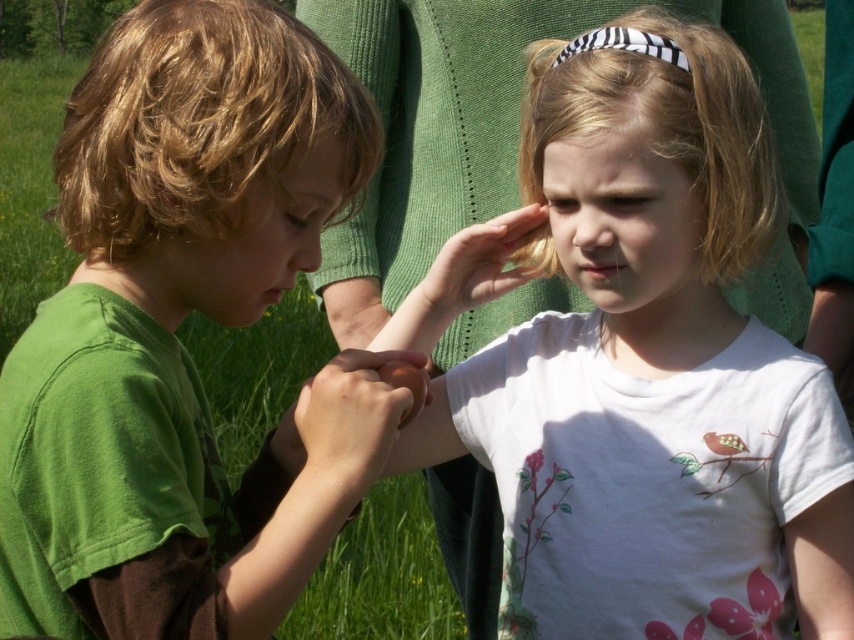
You are a photographer trying to capture a closeup of the white matte shirt at center and the blonde hair at upper right. Based on their positions, which one should you focus on first to ensure both are in the frame?

The white matte shirt at center is below the blonde hair at upper right, so you should focus on the blonde hair at upper right first to ensure both are in the frame.

You are a photographer trying to capture the perfect shot of the two children. You notice the white matte shirt at center and the blonde hair at upper right. Which object should you focus on to ensure it appears more prominent in the photo?

The white matte shirt at center should be focused on because it is larger in size than the blonde hair at upper right, making it naturally more prominent.

You are a photographer trying to capture a closeup of the matte green shirt at center and the smooth brown hand at center. Which object should you focus on first to ensure it appears sharp in the photo?

The matte green shirt at center is closer to the viewer than the smooth brown hand at center, so you should focus on the matte green shirt at center first to ensure it appears sharp.